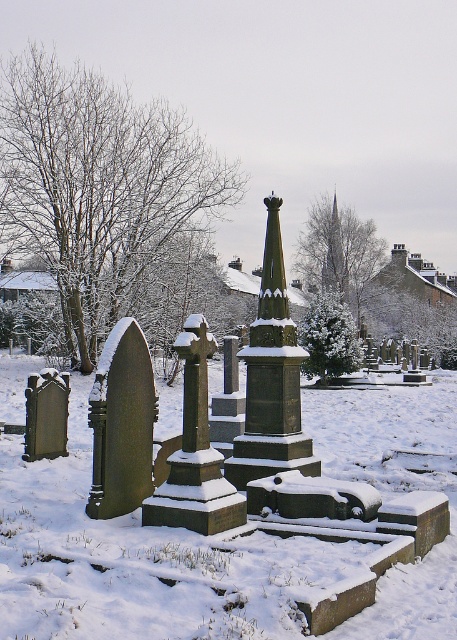
You are standing at point (138,561) in the cemetery scene. What is the terrain like at your current location?

The terrain at point (138,561) is white frosty snow at center.

You are standing in the cemetery and notice the white frosty snow at center and the smooth gray spire at upper center. Which object is taller?

The smooth gray spire at upper center is taller than the white frosty snow at center.

You are standing at the entrance of the cemetery and want to take a photo that includes both point (x=380, y=392) and point (x=327, y=269). Based on their positions, which point will appear larger in the photo?

Point (x=380, y=392) is closer to the camera than point (x=327, y=269), so it will appear larger in the photo.